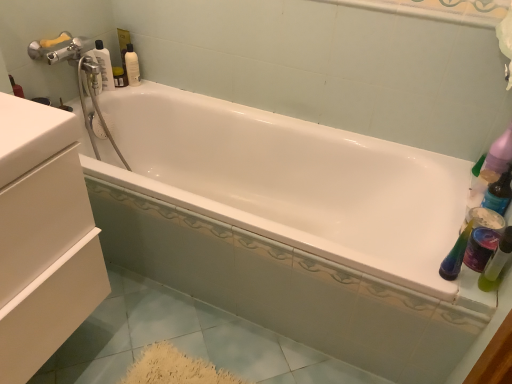
Question: Should I look upward or downward to see white matte drawer at left?

Choices:
 (A) down
 (B) up

Answer: (A)

Question: Is transparent plastic bottle at upper left thinner than white glossy mouthwash at upper left, the second mouthwash in the right-to-left sequence?

Choices:
 (A) no
 (B) yes

Answer: (A)

Question: Can you confirm if transparent plastic bottle at upper left is smaller than white glossy mouthwash at upper left, marked as the first mouthwash in a back-to-front arrangement?

Choices:
 (A) no
 (B) yes

Answer: (A)

Question: Is transparent plastic bottle at upper left oriented away from white glossy mouthwash at upper left, arranged as the second mouthwash when ordered from the bottom?

Choices:
 (A) yes
 (B) no

Answer: (B)

Question: Is transparent plastic bottle at upper left not within white glossy mouthwash at upper left, the first mouthwash in the left-to-right sequence?

Choices:
 (A) no
 (B) yes

Answer: (B)

Question: From the image's perspective, is transparent plastic bottle at upper left on white glossy mouthwash at upper left, arranged as the second mouthwash when ordered from the bottom?

Choices:
 (A) no
 (B) yes

Answer: (A)

Question: Does transparent plastic bottle at upper left have a larger size compared to white glossy mouthwash at upper left, the first mouthwash in the left-to-right sequence?

Choices:
 (A) yes
 (B) no

Answer: (A)

Question: Can you confirm if white matte drawer at left is thinner than green translucent bottle at right, the 2th mouthwash positioned from the left?

Choices:
 (A) no
 (B) yes

Answer: (A)

Question: Can you confirm if white matte drawer at left is bigger than green translucent bottle at right, the 2th mouthwash positioned from the left?

Choices:
 (A) no
 (B) yes

Answer: (B)

Question: Is white matte drawer at left smaller than green translucent bottle at right, positioned as the second mouthwash in top-to-bottom order?

Choices:
 (A) no
 (B) yes

Answer: (A)

Question: Considering the relative sizes of white matte drawer at left and green translucent bottle at right, arranged as the second mouthwash when viewed from the back, in the image provided, is white matte drawer at left wider than green translucent bottle at right, arranged as the second mouthwash when viewed from the back,?

Choices:
 (A) yes
 (B) no

Answer: (A)

Question: From a real-world perspective, is white matte drawer at left on top of green translucent bottle at right, positioned as the second mouthwash in top-to-bottom order?

Choices:
 (A) yes
 (B) no

Answer: (B)

Question: Is white matte drawer at left oriented away from green translucent bottle at right, positioned as the second mouthwash in top-to-bottom order?

Choices:
 (A) yes
 (B) no

Answer: (B)

Question: Is green translucent bottle at right, the first mouthwash when ordered from right to left, shorter than transparent plastic bottle at upper left?

Choices:
 (A) yes
 (B) no

Answer: (A)